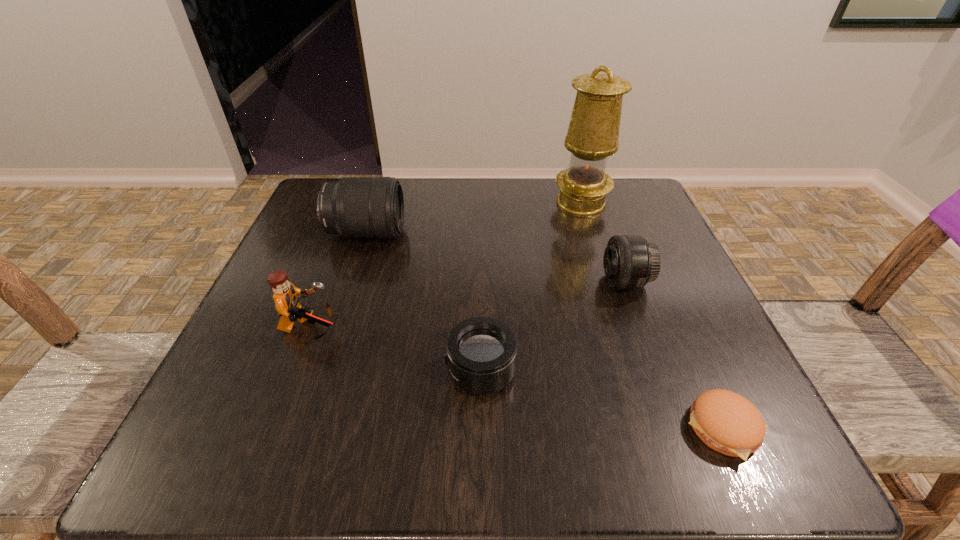
The image size is (960, 540). Find the location of `free space that is in between the shortest telephoto lens and the third shortest object`. free space that is in between the shortest telephoto lens and the third shortest object is located at coordinates (553, 326).

You are a GUI agent. You are given a task and a screenshot of the screen. Output one action in this format:
    pyautogui.click(x=<x>, y=<y>)
    Task: Click on the free space between the patty and the second shortest telephoto lens
    This screenshot has width=960, height=540.
    Given the screenshot: What is the action you would take?
    pyautogui.click(x=675, y=355)

The width and height of the screenshot is (960, 540). I want to click on vacant space that is in between the second telephoto lens from right to left and the Lego, so click(396, 350).

The image size is (960, 540). What are the coordinates of `free space between the tallest telephoto lens and the Lego` in the screenshot? It's located at (338, 281).

Image resolution: width=960 pixels, height=540 pixels. Find the location of `free spot between the third farthest object and the Lego`. free spot between the third farthest object and the Lego is located at coordinates [468, 306].

At what (x,y) coordinates should I click in order to perform the action: click on empty space between the tallest object and the shortest telephoto lens. Please return your answer as a coordinate pair (x, y). This screenshot has height=540, width=960. Looking at the image, I should click on (531, 287).

Choose which object is the third nearest neighbor to the fourth object from right to left. Please provide its 2D coordinates. Your answer should be formatted as a tuple, i.e. [(x, y)], where the tuple contains the x and y coordinates of a point satisfying the conditions above.

[(725, 421)]

Identify the location of object that is the closest one to the oil lamp. Image resolution: width=960 pixels, height=540 pixels. click(x=630, y=262).

You are a GUI agent. You are given a task and a screenshot of the screen. Output one action in this format:
    pyautogui.click(x=<x>, y=<y>)
    Task: Click on the telephoto lens identified as the second closest to the patty
    The height and width of the screenshot is (540, 960).
    Given the screenshot: What is the action you would take?
    pyautogui.click(x=481, y=352)

Locate an element on the screen. Image resolution: width=960 pixels, height=540 pixels. telephoto lens that is the second nearest to the third shortest object is located at coordinates (356, 207).